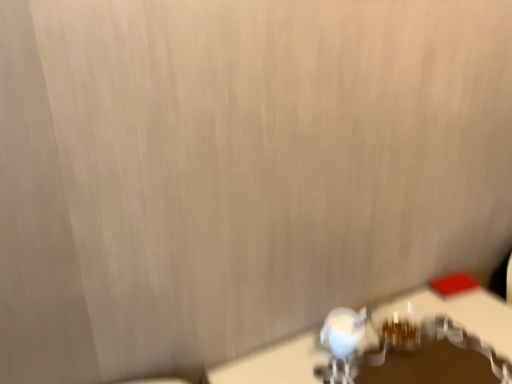
Locate an element on the screen. blank space to the left of white glossy faucet at lower center is located at coordinates (289, 358).